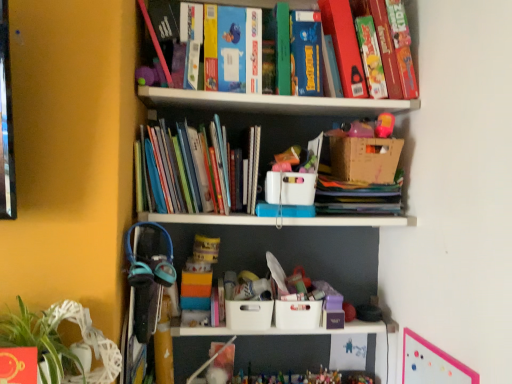
Question: Should I look upward or downward to see hardcover book at upper right, the second book in the left-to-right sequence?

Choices:
 (A) down
 (B) up

Answer: (B)

Question: From the image's perspective, would you say white wicker swivel chair at lower left is shown under pink matte bulletin board at upper right?

Choices:
 (A) no
 (B) yes

Answer: (A)

Question: Is pink matte bulletin board at upper right at the back of white wicker swivel chair at lower left?

Choices:
 (A) no
 (B) yes

Answer: (A)

Question: Considering the relative sizes of white wicker swivel chair at lower left and pink matte bulletin board at upper right in the image provided, is white wicker swivel chair at lower left shorter than pink matte bulletin board at upper right?

Choices:
 (A) no
 (B) yes

Answer: (B)

Question: Are white wicker swivel chair at lower left and pink matte bulletin board at upper right beside each other?

Choices:
 (A) yes
 (B) no

Answer: (B)

Question: Would you say white wicker swivel chair at lower left contains pink matte bulletin board at upper right?

Choices:
 (A) yes
 (B) no

Answer: (B)

Question: Is white wicker swivel chair at lower left not near pink matte bulletin board at upper right?

Choices:
 (A) no
 (B) yes

Answer: (A)

Question: Is white plastic basket at center, the third storage box positioned from the bottom, turned away from matte pink toy at upper right?

Choices:
 (A) yes
 (B) no

Answer: (B)

Question: From the image's perspective, is white plastic basket at center, the third storage box positioned from the bottom, located beneath matte pink toy at upper right?

Choices:
 (A) yes
 (B) no

Answer: (A)

Question: Does white plastic basket at center, the third storage box positioned from the bottom, have a greater width compared to matte pink toy at upper right?

Choices:
 (A) yes
 (B) no

Answer: (A)

Question: Is the position of white plastic basket at center, the third storage box positioned from the bottom, more distant than that of matte pink toy at upper right?

Choices:
 (A) no
 (B) yes

Answer: (A)

Question: From a real-world perspective, is white plastic basket at center, the first storage box from the top, on matte pink toy at upper right?

Choices:
 (A) yes
 (B) no

Answer: (B)

Question: Is white plastic basket at center, the first storage box from the top, to the left of matte pink toy at upper right from the viewer's perspective?

Choices:
 (A) yes
 (B) no

Answer: (A)

Question: Is the depth of pink matte bulletin board at upper right greater than that of hardcover book at upper right, the 1th book in the top-to-bottom sequence?

Choices:
 (A) yes
 (B) no

Answer: (B)